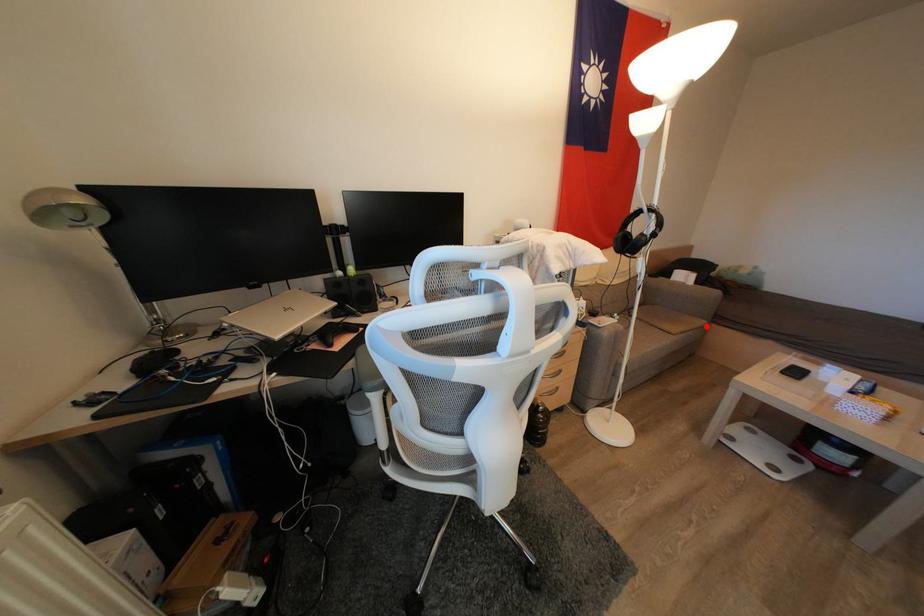
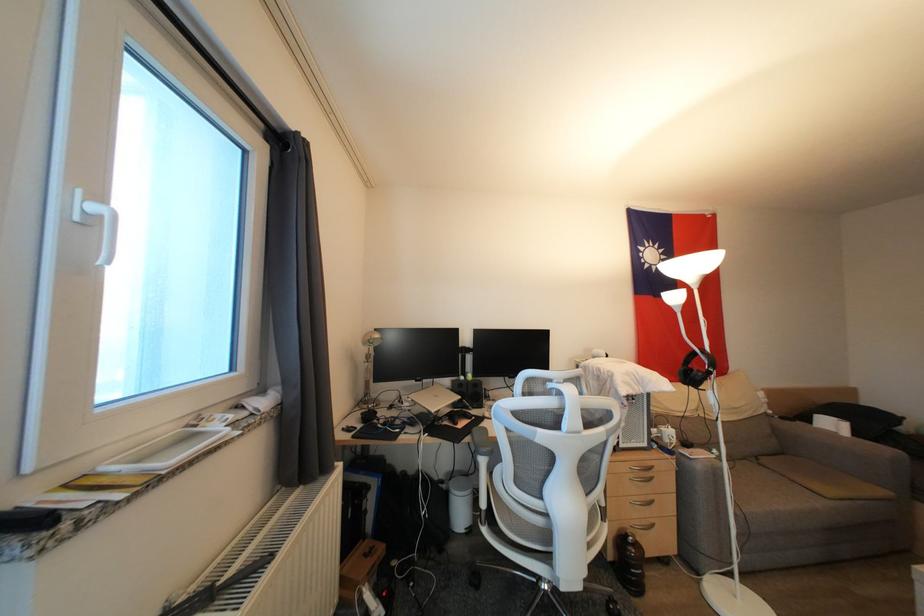
Question: I am providing you with two images of the same scene from different viewpoints. Image1 has a red point marked. In image2, the corresponding 3D location appears at what relative position? Reply with the corresponding letter.

Choices:
 (A) Closer
 (B) Farther

Answer: (A)